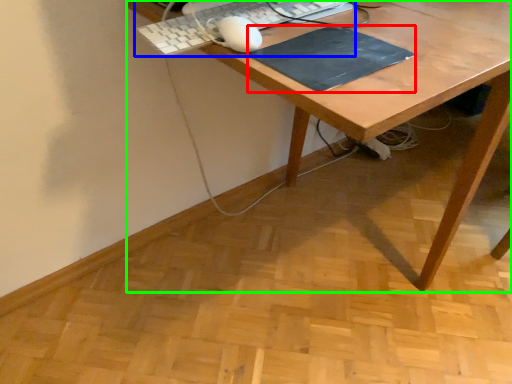
Question: Which object is positioned closest to mousepad (highlighted by a red box)? Select from computer keyboard (highlighted by a blue box) and desk (highlighted by a green box).

Choices:
 (A) computer keyboard
 (B) desk

Answer: (B)